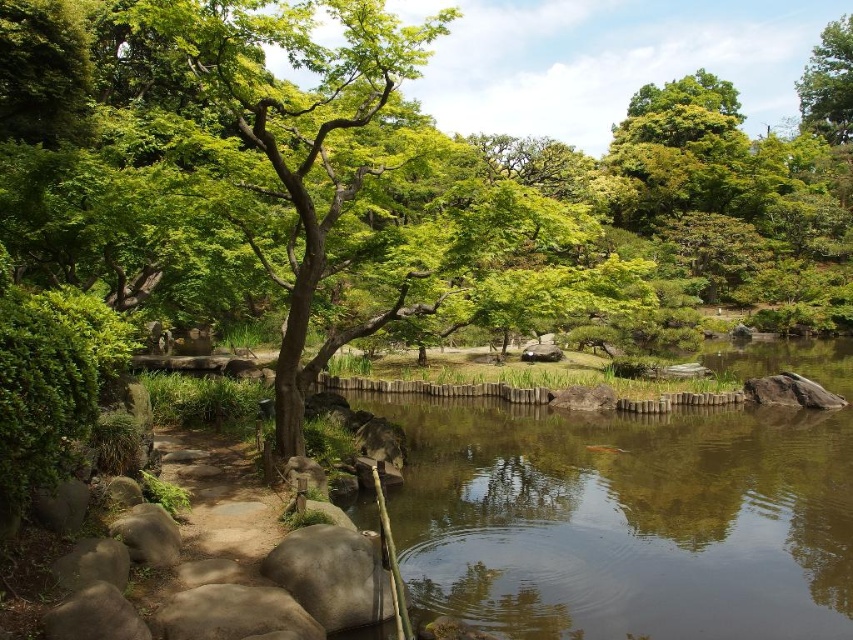
You are a gardener planning to install a small wooden bridge over the smooth brown water at center and the green leafy tree at upper right. Based on their heights, which object would require more elevation for the bridge to pass over it?

The green leafy tree at upper right requires more elevation for the bridge to pass over it because it has a greater height than the smooth brown water at center.

You are standing in the garden and want to take a photo of the point at coordinates point (453, 576). If your camera has a maximum focus range of 30 feet, will it be able to focus on that point?

The distance of point (453, 576) from camera is 29.88 feet, which is within the camera maximum focus range of 30 feet. So the camera can focus on that point.